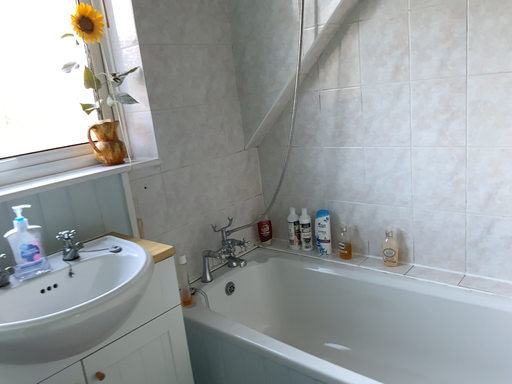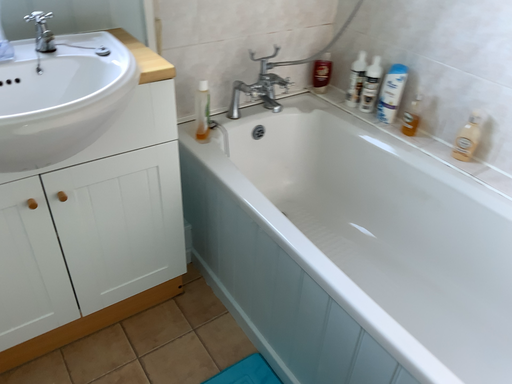
Question: How did the camera likely rotate when shooting the video?

Choices:
 (A) rotated left
 (B) rotated right

Answer: (A)